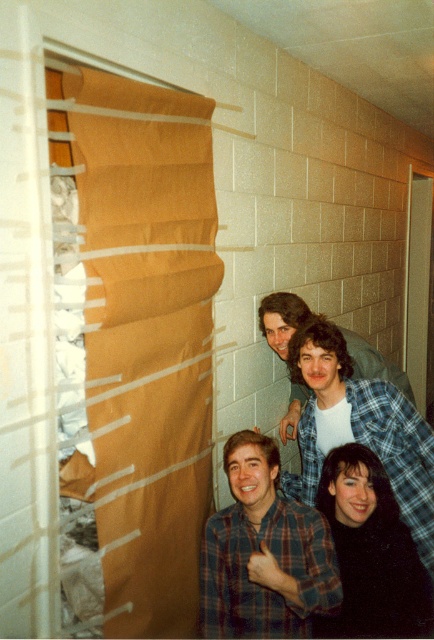
You are a photographer trying to capture a group photo of the plaid flannel shirt at center and the matte plaid shirt at center. Since you want to ensure both shirts are clearly visible in the frame, which shirt should you position closer to the camera to avoid one blocking the other?

The plaid flannel shirt at center is much taller than the matte plaid shirt at center, so you should position the matte plaid shirt at center closer to the camera to ensure both are visible without one blocking the other.

You are a photographer trying to capture a group photo in a basement with two people wearing plaid flannel shirts and another wearing a matte plaid shirt. The scene requires them to stand closer so that the distance between the plaid flannel shirt at center and the matte plaid shirt at center is less than 10 inches. Can they adjust their positions to meet this requirement?

The plaid flannel shirt at center and matte plaid shirt at center are currently 10.01 inches apart. Since the requirement is less than 10 inches, they need to move slightly closer to reduce the distance by at least 0.01 inches.